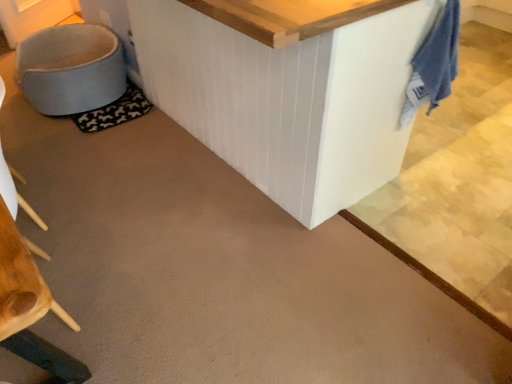
Question: Considering the relative sizes of light blue fabric swivel chair at lower left and blue cotton towel at upper right in the image provided, is light blue fabric swivel chair at lower left shorter than blue cotton towel at upper right?

Choices:
 (A) no
 (B) yes

Answer: (B)

Question: Is light blue fabric swivel chair at lower left at the left side of blue cotton towel at upper right?

Choices:
 (A) yes
 (B) no

Answer: (A)

Question: Does light blue fabric swivel chair at lower left come in front of blue cotton towel at upper right?

Choices:
 (A) yes
 (B) no

Answer: (B)

Question: Is light blue fabric swivel chair at lower left facing away from blue cotton towel at upper right?

Choices:
 (A) yes
 (B) no

Answer: (B)

Question: Can you confirm if light blue fabric swivel chair at lower left is bigger than blue cotton towel at upper right?

Choices:
 (A) yes
 (B) no

Answer: (A)

Question: From the image's perspective, is light blue fabric swivel chair at lower left located beneath blue cotton towel at upper right?

Choices:
 (A) no
 (B) yes

Answer: (A)

Question: From the image's perspective, would you say black fabric mat at lower left is shown under blue cotton towel at upper right?

Choices:
 (A) yes
 (B) no

Answer: (B)

Question: Is black fabric mat at lower left bigger than blue cotton towel at upper right?

Choices:
 (A) yes
 (B) no

Answer: (B)

Question: From a real-world perspective, is black fabric mat at lower left below blue cotton towel at upper right?

Choices:
 (A) no
 (B) yes

Answer: (B)

Question: From a real-world perspective, is black fabric mat at lower left positioned over blue cotton towel at upper right based on gravity?

Choices:
 (A) no
 (B) yes

Answer: (A)

Question: Is black fabric mat at lower left far from blue cotton towel at upper right?

Choices:
 (A) no
 (B) yes

Answer: (B)

Question: Is black fabric mat at lower left wider than blue cotton towel at upper right?

Choices:
 (A) yes
 (B) no

Answer: (A)

Question: Does blue cotton towel at upper right have a lesser width compared to light blue fabric swivel chair at lower left?

Choices:
 (A) yes
 (B) no

Answer: (A)